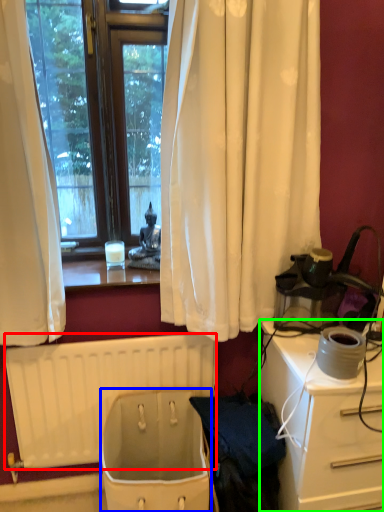
Question: Which object is the farthest from radiator (highlighted by a red box)? Choose among these: toilet bowl (highlighted by a blue box) or desk (highlighted by a green box).

Choices:
 (A) toilet bowl
 (B) desk

Answer: (B)